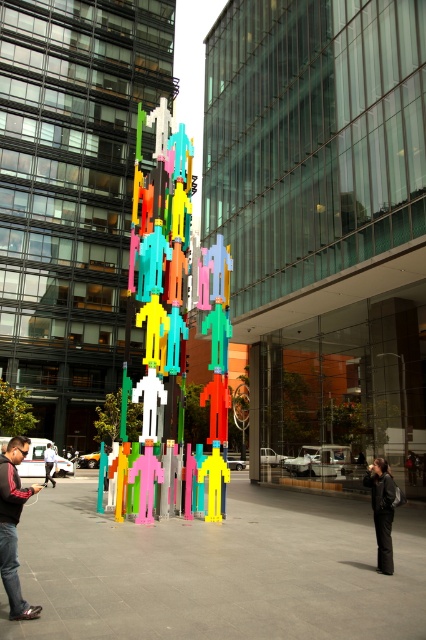
You are an artist planning to create a miniature version of the sculpture in the image. You have a limited amount of white plastic material. Which object from the scene should you prioritize reducing in size to conserve material, the black matte pants at lower right or the white plastic figure at center?

You should prioritize reducing the size of the black matte pants at lower right because it is larger than the white plastic figure at center, so scaling it down would save more material.

You are an architect designing a new public space and want to place a sculpture in the center. The city requires that the sculpture must be placed exactly at coordinates point 0.444, 0.373. Does the multicolored plastic figures at center meet this requirement?

Yes, the multicolored plastic figures at center is already positioned at point (158,284), so it meets the city requirement.

You are a fashion designer who wants to place a mannequin wearing a black leather jacket at lower left next to a white plastic figure at center. Based on the scene, which object is taller?

The black leather jacket at lower left is taller than the white plastic figure at center according to the description.